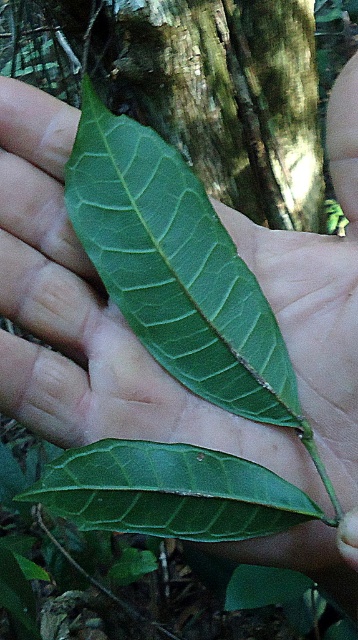
Between green matte leaf at center and green glossy leaf at center, which one has less height?

With less height is green glossy leaf at center.

Does point (269, 413) come farther from viewer compared to point (214, 468)?

Yes.

Between point (128, 220) and point (230, 502), which one is positioned behind?

The point (128, 220) is more distant.

Where is `green matte leaf at center`? green matte leaf at center is located at coordinates [x=176, y=268].